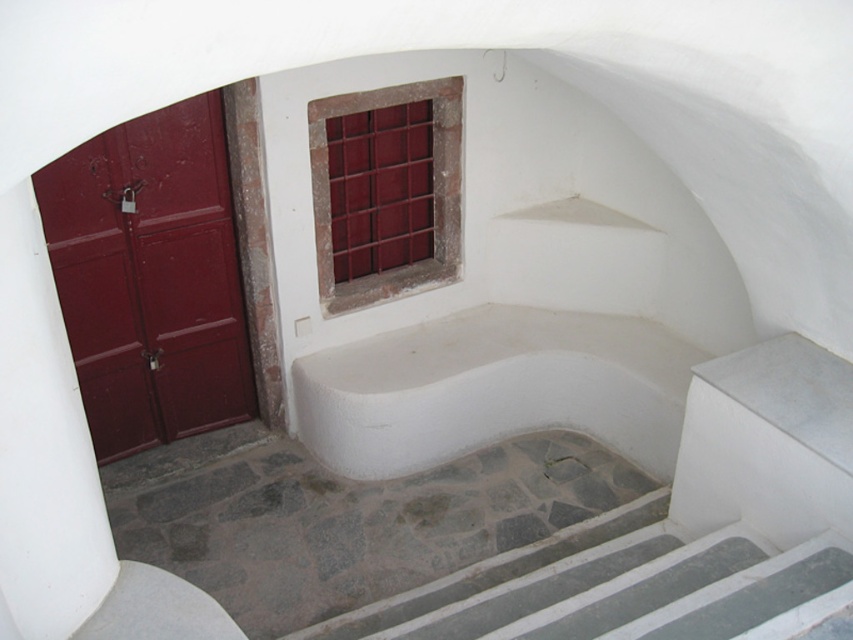
Question: In this image, where is gray stone stairs at lower center located relative to maroon glass window at upper center?

Choices:
 (A) above
 (B) below

Answer: (B)

Question: Which point appears closest to the camera in this image?

Choices:
 (A) (399, 632)
 (B) (352, 100)
 (C) (85, 305)

Answer: (A)

Question: Which point appears farthest from the camera in this image?

Choices:
 (A) (434, 179)
 (B) (438, 588)

Answer: (A)

Question: From the image, what is the correct spatial relationship of gray stone stairs at lower center in relation to maroon glass window at upper center?

Choices:
 (A) above
 (B) below

Answer: (B)

Question: Is gray stone stairs at lower center above maroon glass window at upper center?

Choices:
 (A) yes
 (B) no

Answer: (B)

Question: Among these objects, which one is farthest from the camera?

Choices:
 (A) matte red door at left
 (B) gray stone stairs at lower center

Answer: (A)